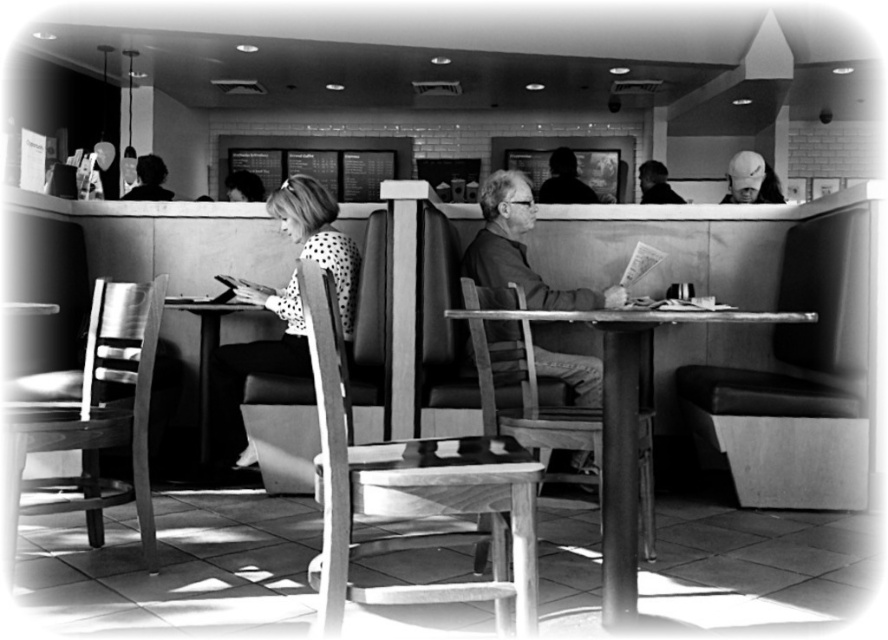
Question: Which of these objects is positioned closest to the smooth leather jacket at upper center?

Choices:
 (A) wooden table at center
 (B) wooden table at lower left
 (C) polka dot blouse at center

Answer: (C)

Question: Which of the following is the closest to the observer?

Choices:
 (A) (519, 173)
 (B) (657, 170)

Answer: (A)

Question: Which point is farther to the camera?

Choices:
 (A) click(x=250, y=308)
 (B) click(x=565, y=176)

Answer: (B)

Question: Can you confirm if wooden table at center is positioned to the left of smooth brown shirt at center?

Choices:
 (A) no
 (B) yes

Answer: (A)

Question: Is polka dot blouse at center closer to the viewer compared to smooth leather jacket at upper center?

Choices:
 (A) yes
 (B) no

Answer: (A)

Question: Is smooth leather jacket at upper center bigger than dark brown leather jacket at upper right?

Choices:
 (A) yes
 (B) no

Answer: (B)